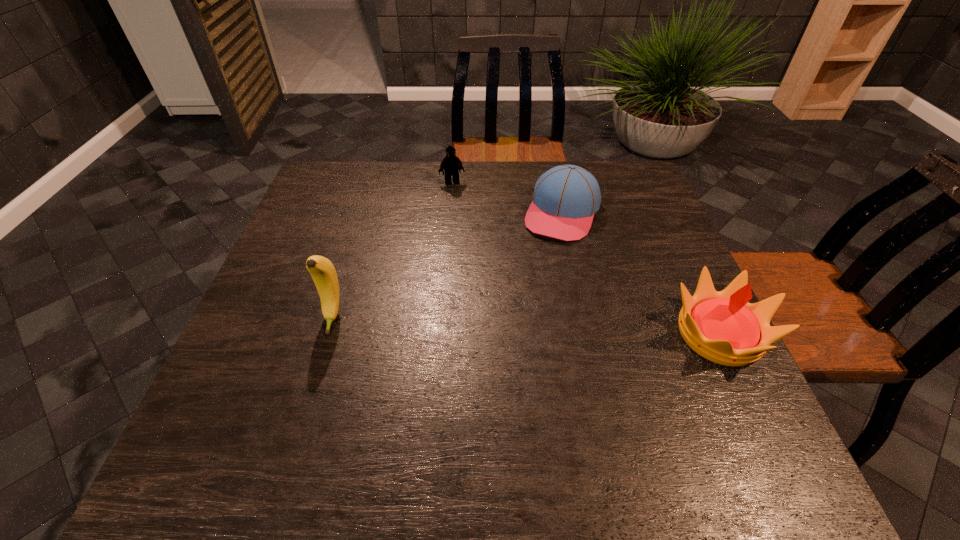
Find the location of a particular element. This screenshot has height=540, width=960. the leftmost object is located at coordinates (323, 273).

Where is `crown`? crown is located at coordinates (723, 327).

The width and height of the screenshot is (960, 540). I want to click on baseball cap, so click(565, 198).

The height and width of the screenshot is (540, 960). In order to click on the second object from right to left in this screenshot , I will do `click(565, 198)`.

The width and height of the screenshot is (960, 540). Identify the location of the second object from left to right. [x=451, y=164].

The height and width of the screenshot is (540, 960). I want to click on the farthest object, so click(451, 164).

Identify the location of free space located 0.140m from the stem of the leftmost object. The width and height of the screenshot is (960, 540). (309, 394).

This screenshot has height=540, width=960. In order to click on free region located 0.330m on the left of the rightmost object in this screenshot , I will do `click(516, 334)`.

In order to click on vacant space positioned 0.160m on the front-facing side of the second object from right to left in this screenshot , I will do `click(535, 282)`.

I want to click on free location located on the front-facing side of the second object from right to left, so click(x=543, y=264).